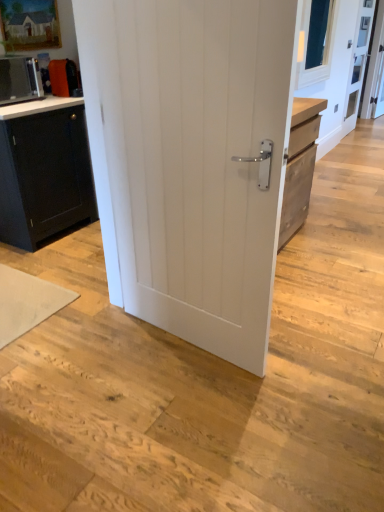
Where is `blank space situated above white matte yoga mat at lower left (from a real-world perspective)`? blank space situated above white matte yoga mat at lower left (from a real-world perspective) is located at coordinates (19, 295).